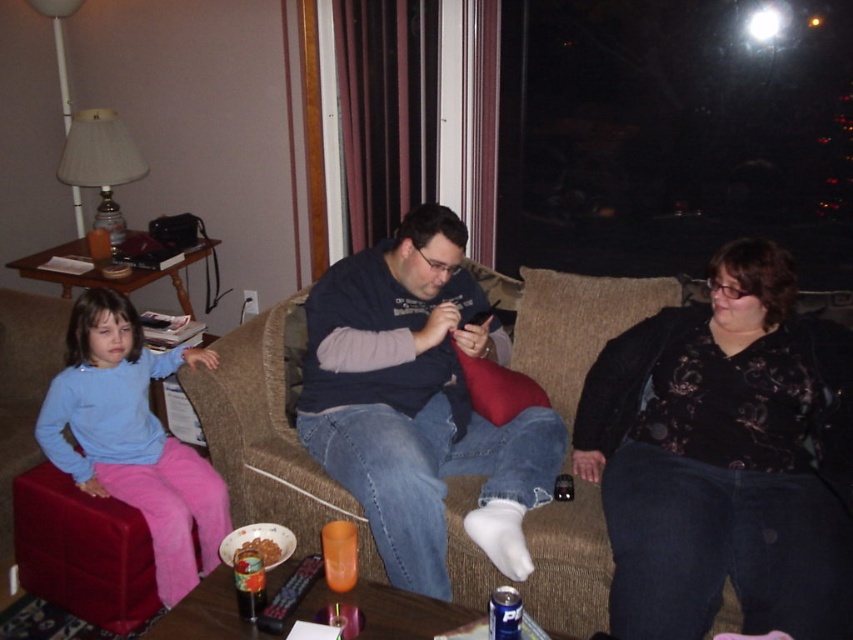
Is point (718, 292) closer to camera compared to point (172, 440)?

Yes, point (718, 292) is closer to viewer.

Image resolution: width=853 pixels, height=640 pixels. What are the coordinates of `black floral sweater at center` in the screenshot? It's located at (724, 458).

Can you confirm if black floral sweater at center is smaller than shiny chocolate bar at lower center?

No.

Which is behind, point (625, 333) or point (260, 548)?

Point (625, 333)

Where is `black floral sweater at center`? black floral sweater at center is located at coordinates (724, 458).

Locate an element on the screen. Image resolution: width=853 pixels, height=640 pixels. black floral sweater at center is located at coordinates (724, 458).

Is brown fabric couch at center to the left of shiny chocolate bar at lower center from the viewer's perspective?

In fact, brown fabric couch at center is to the right of shiny chocolate bar at lower center.

Is brown fabric couch at center shorter than shiny chocolate bar at lower center?

In fact, brown fabric couch at center may be taller than shiny chocolate bar at lower center.

Does point (567, 525) lie behind point (265, 545)?

That is True.

Image resolution: width=853 pixels, height=640 pixels. I want to click on brown fabric couch at center, so click(270, 435).